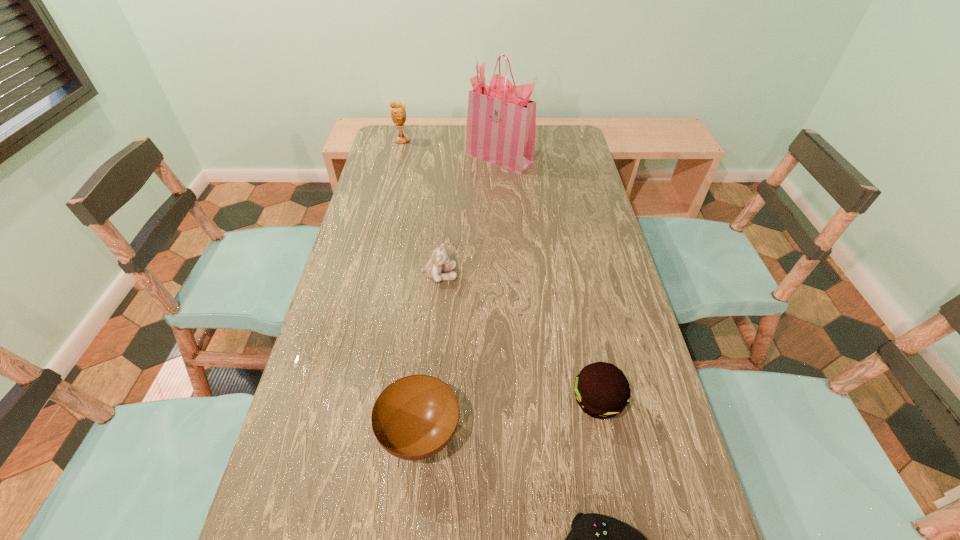
The image size is (960, 540). In order to click on free region located 0.390m on the right of the bowl in this screenshot , I will do pos(647,435).

Find the location of a particular element. shopping bag that is at the far edge is located at coordinates (501, 122).

Locate an element on the screen. This screenshot has height=540, width=960. chalice that is at the far edge is located at coordinates (397, 109).

Where is `object that is positioned at the left edge`? The width and height of the screenshot is (960, 540). object that is positioned at the left edge is located at coordinates (397, 109).

The height and width of the screenshot is (540, 960). What are the coordinates of `object located in the right edge section of the desktop` in the screenshot? It's located at (602, 391).

Find the location of a particular element. The width and height of the screenshot is (960, 540). object that is at the far left corner is located at coordinates (397, 109).

The height and width of the screenshot is (540, 960). In the image, there is a desktop. Find the location of `vacant area at the far edge`. vacant area at the far edge is located at coordinates (424, 125).

At what (x,y) coordinates should I click in order to perform the action: click on vacant position at the left edge of the desktop. Please return your answer as a coordinate pair (x, y). Image resolution: width=960 pixels, height=540 pixels. Looking at the image, I should click on (345, 329).

The image size is (960, 540). In order to click on vacant space at the right edge of the desktop in this screenshot , I will do `click(594, 198)`.

In order to click on free point between the bowl and the shopping bag in this screenshot , I will do `click(460, 296)`.